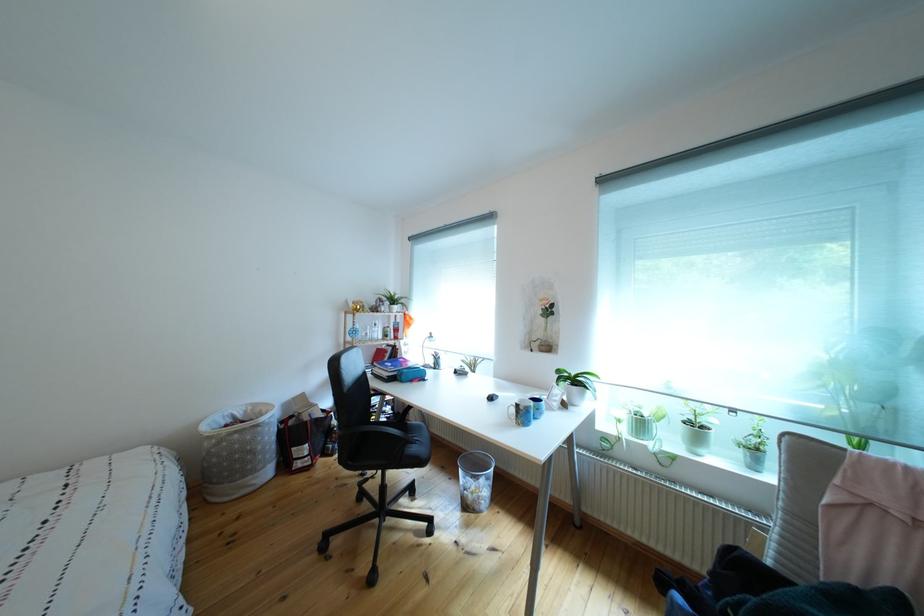
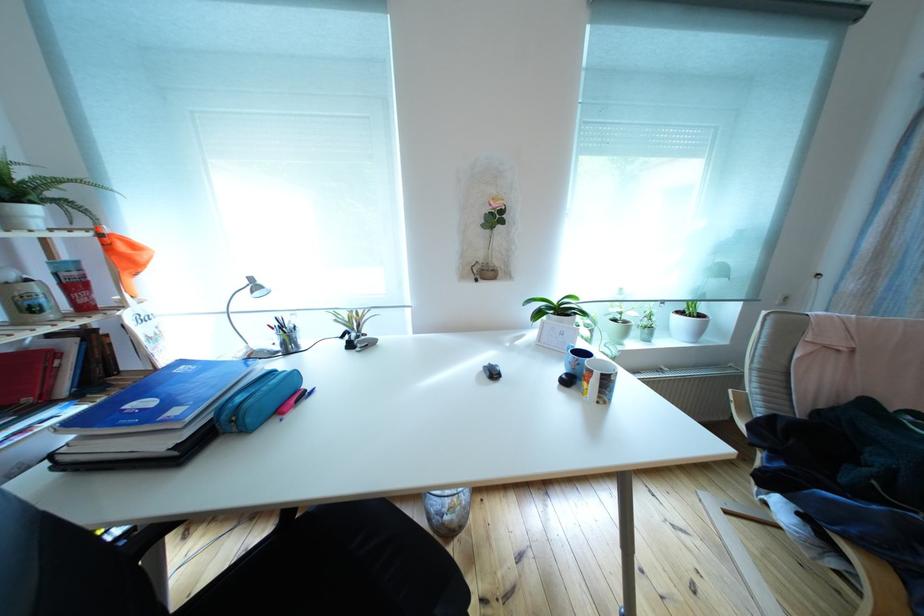
In the second image, find the point that corresponds to point (588, 387) in the first image.

(576, 315)